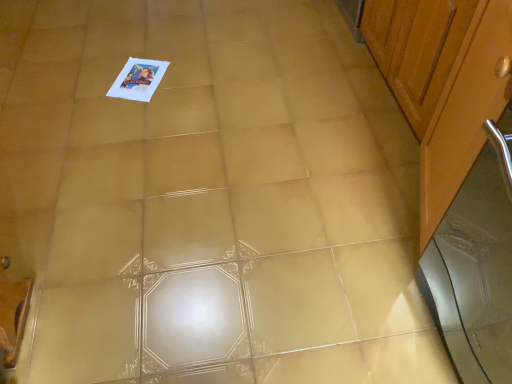
Question: From a real-world perspective, does silver metallic screen door at right stand above wooden cabinet at right, placed as the 1th cabinetry when sorted from front to back?

Choices:
 (A) no
 (B) yes

Answer: (A)

Question: Is silver metallic screen door at right oriented away from wooden cabinet at right, placed as the 1th cabinetry when sorted from front to back?

Choices:
 (A) no
 (B) yes

Answer: (A)

Question: Is silver metallic screen door at right directly adjacent to wooden cabinet at right, placed as the 1th cabinetry when sorted from front to back?

Choices:
 (A) no
 (B) yes

Answer: (A)

Question: From the image's perspective, is silver metallic screen door at right located above wooden cabinet at right, placed as the 1th cabinetry when sorted from front to back?

Choices:
 (A) no
 (B) yes

Answer: (A)

Question: Is silver metallic screen door at right at the right side of wooden cabinet at right, the second cabinetry when ordered from back to front?

Choices:
 (A) yes
 (B) no

Answer: (B)

Question: Looking at the image, does wooden cabinet at right, placed as the 1th cabinetry when sorted from front to back, seem bigger or smaller compared to wooden cabinet at right, the 1th cabinetry viewed from the back?

Choices:
 (A) small
 (B) big

Answer: (A)

Question: Which is correct: wooden cabinet at right, placed as the 1th cabinetry when sorted from front to back, is inside wooden cabinet at right, which is the second cabinetry in front-to-back order, or outside of it?

Choices:
 (A) outside
 (B) inside

Answer: (A)

Question: Is wooden cabinet at right, the second cabinetry when ordered from back to front, in front of or behind wooden cabinet at right, which is the second cabinetry in front-to-back order, in the image?

Choices:
 (A) behind
 (B) front

Answer: (B)

Question: From the image's perspective, is wooden cabinet at right, placed as the 1th cabinetry when sorted from front to back, located above or below wooden cabinet at right, which is the second cabinetry in front-to-back order?

Choices:
 (A) above
 (B) below

Answer: (B)

Question: Is silver metallic screen door at right bigger or smaller than wooden cabinet at right, the 1th cabinetry viewed from the back?

Choices:
 (A) big
 (B) small

Answer: (B)

Question: From a real-world perspective, is silver metallic screen door at right physically located above or below wooden cabinet at right, which is the second cabinetry in front-to-back order?

Choices:
 (A) above
 (B) below

Answer: (A)

Question: From the image's perspective, is silver metallic screen door at right above or below wooden cabinet at right, which is the second cabinetry in front-to-back order?

Choices:
 (A) below
 (B) above

Answer: (A)

Question: Considering the positions of silver metallic screen door at right and wooden cabinet at right, the 1th cabinetry viewed from the back, in the image, is silver metallic screen door at right taller or shorter than wooden cabinet at right, the 1th cabinetry viewed from the back,?

Choices:
 (A) short
 (B) tall

Answer: (B)

Question: From the image's perspective, relative to silver metallic screen door at right, is wooden cabinet at right, placed as the 1th cabinetry when sorted from front to back, above or below?

Choices:
 (A) below
 (B) above

Answer: (B)

Question: Based on their sizes in the image, would you say wooden cabinet at right, placed as the 1th cabinetry when sorted from front to back, is bigger or smaller than silver metallic screen door at right?

Choices:
 (A) small
 (B) big

Answer: (B)